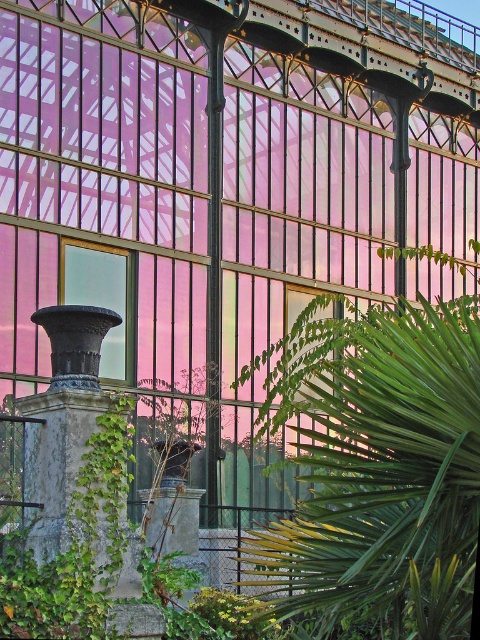
Does dark gray stone column at lower left have a larger size compared to transparent glass window at center?

Yes.

Does point (97, 541) lie behind point (300, 298)?

No, it is not.

Describe the element at coordinates (62, 420) in the screenshot. I see `dark gray stone column at lower left` at that location.

Identify the location of dark gray stone column at lower left. This screenshot has height=640, width=480. (62, 420).

Based on the photo, is green leafy palm at center above transparent glass window at center?

Incorrect, green leafy palm at center is not positioned above transparent glass window at center.

Does green leafy palm at center have a lesser height compared to transparent glass window at center?

Incorrect, green leafy palm at center's height does not fall short of transparent glass window at center's.

Where is `green leafy palm at center`? The image size is (480, 640). green leafy palm at center is located at coordinates (377, 467).

Can you confirm if green leafy palm at center is shorter than dark gray stone column at lower left?

No.

Can you confirm if green leafy palm at center is positioned above dark gray stone column at lower left?

Correct, green leafy palm at center is located above dark gray stone column at lower left.

Between point (458, 376) and point (85, 360), which one is positioned behind?

Positioned behind is point (85, 360).

You are a GUI agent. You are given a task and a screenshot of the screen. Output one action in this format:
    pyautogui.click(x=<x>, y=<y>)
    Task: Click on the green leafy palm at center
    This screenshot has height=640, width=480.
    Given the screenshot: What is the action you would take?
    pyautogui.click(x=377, y=467)